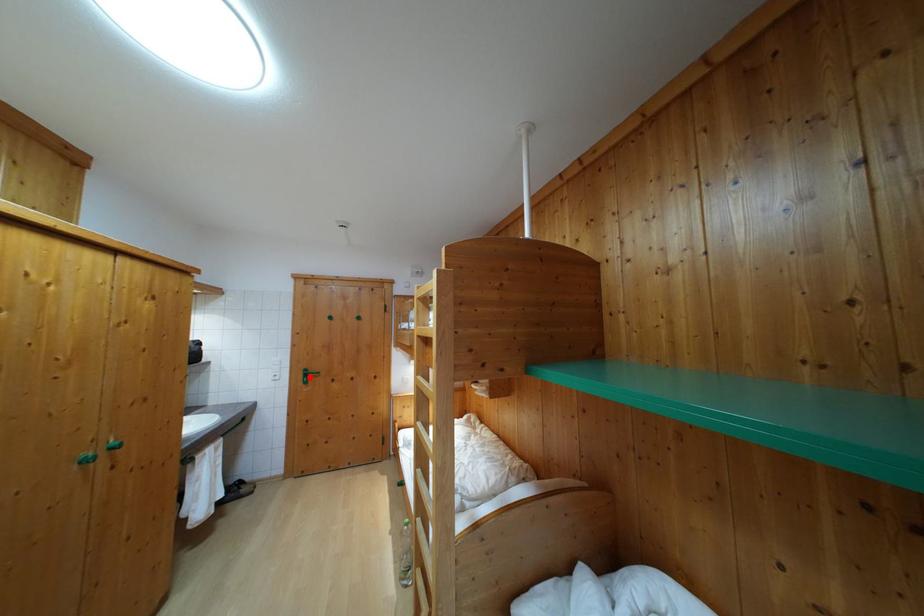
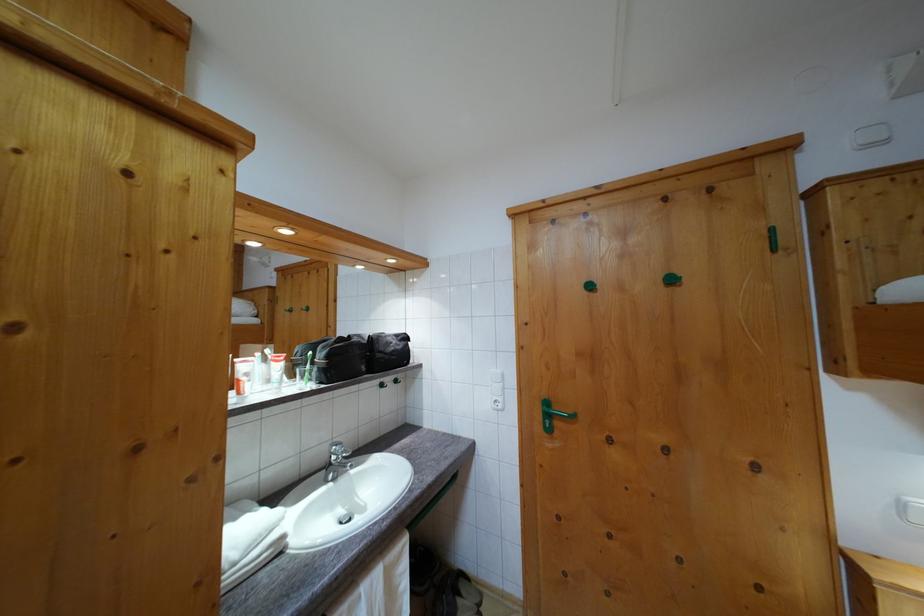
Where in the second image is the point corresponding to the highlighted location from the first image?

(551, 410)